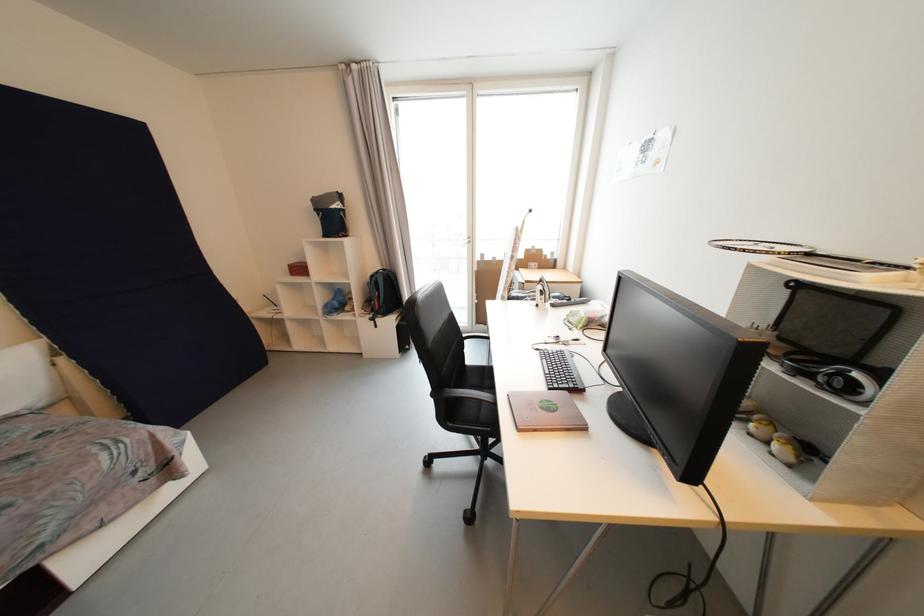
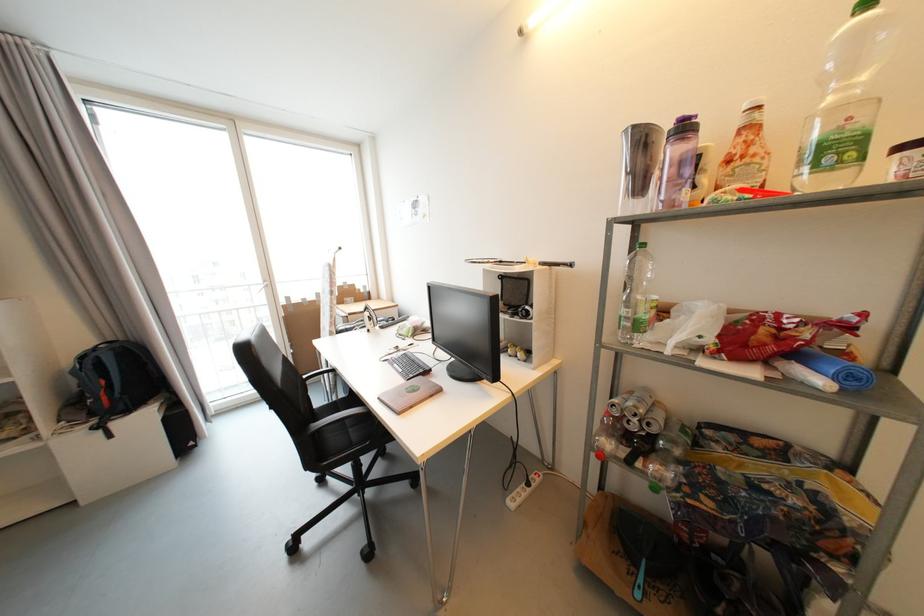
In the second image, find the point that corresponds to (x=378, y=321) in the first image.

(104, 429)